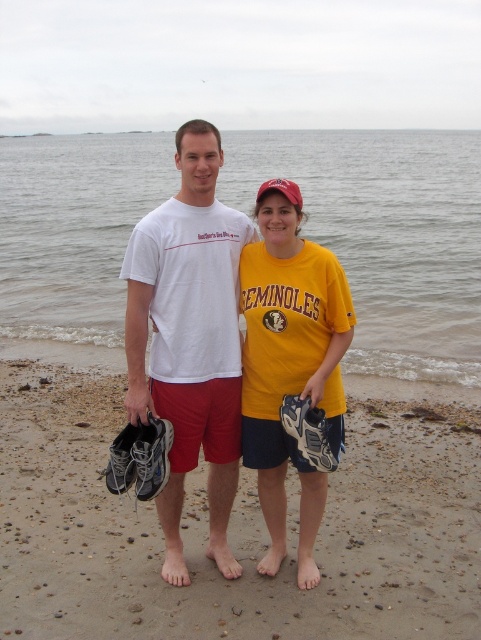
Question: Which point is closer to the camera?

Choices:
 (A) clear water at center
 (B) yellow matte t-shirt at center
 (C) white matte t-shirt at center

Answer: (B)

Question: Which object appears farthest from the camera in this image?

Choices:
 (A) gray synthetic baseball glove at lower center
 (B) brown sandy beach at lower center

Answer: (A)

Question: Does clear water at center appear on the right side of white matte t-shirt at center?

Choices:
 (A) yes
 (B) no

Answer: (B)

Question: Among these points, which one is nearest to the camera?

Choices:
 (A) (291, 228)
 (B) (115, 474)
 (C) (212, 160)

Answer: (B)

Question: Does brown sandy beach at lower center come behind white matte t-shirt at center?

Choices:
 (A) no
 (B) yes

Answer: (A)

Question: Can you confirm if brown sandy beach at lower center is positioned to the right of clear water at center?

Choices:
 (A) no
 (B) yes

Answer: (B)